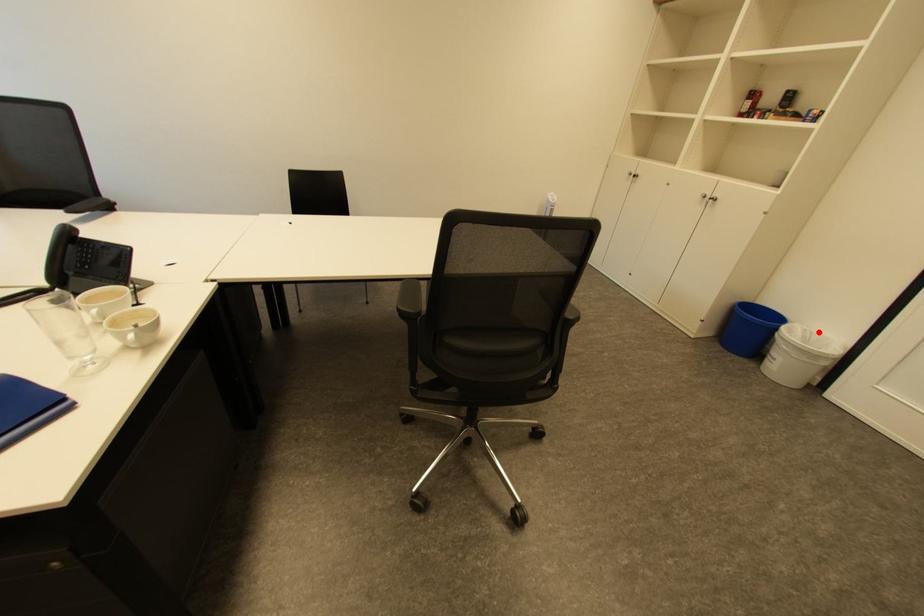
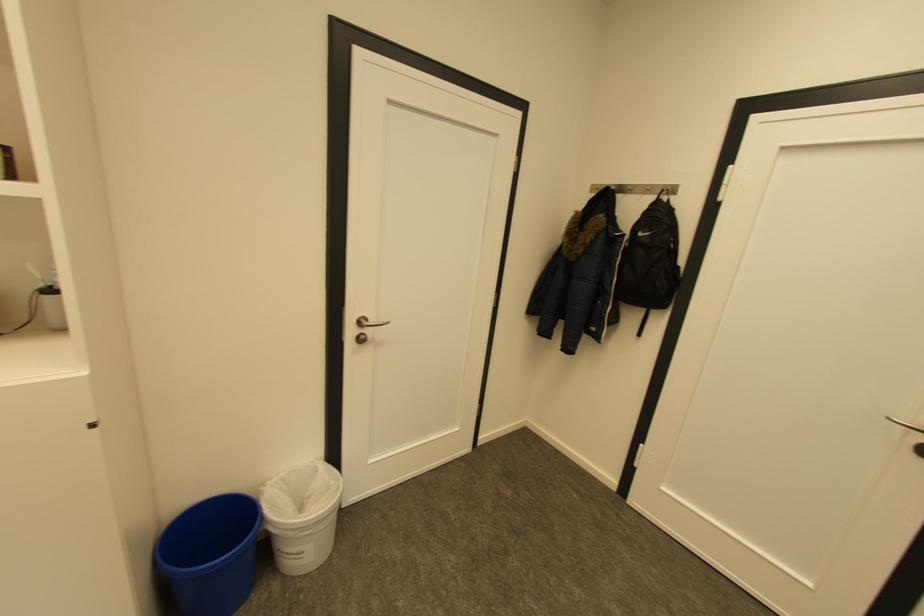
Locate, in the second image, the point that corresponds to the highlighted location in the first image.

(289, 477)